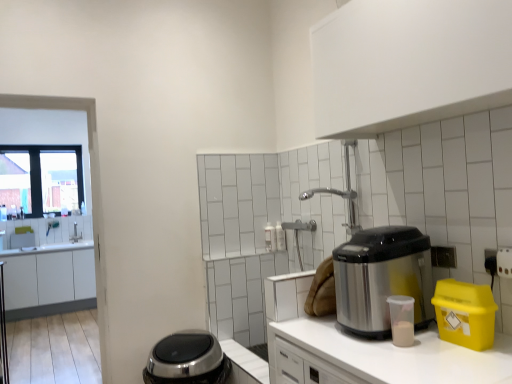
The image size is (512, 384). Identify the location of vacant space to the left of yellow plastic bin at right, the 2th appliance when ordered from back to front. coord(423,348).